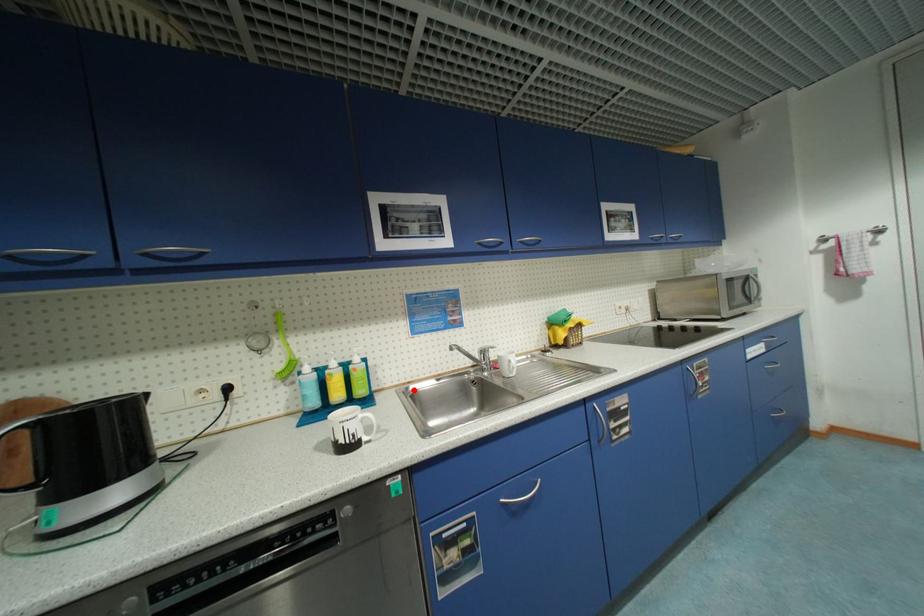
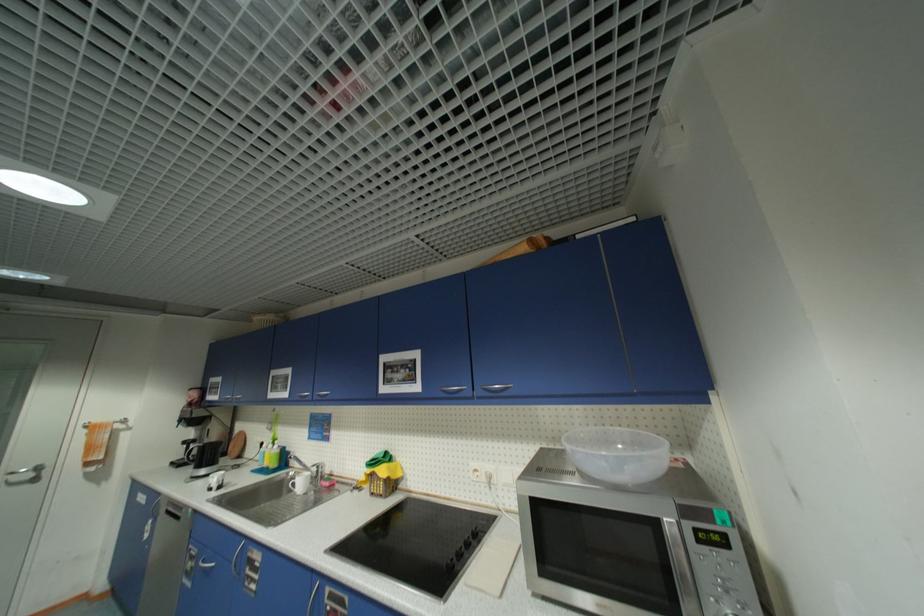
Question: I am providing you with two images of the same scene from different viewpoints. In image1, a red point is highlighted. Considering the same 3D point in image2, which of the following is correct?

Choices:
 (A) It is closer
 (B) It is farther

Answer: (B)